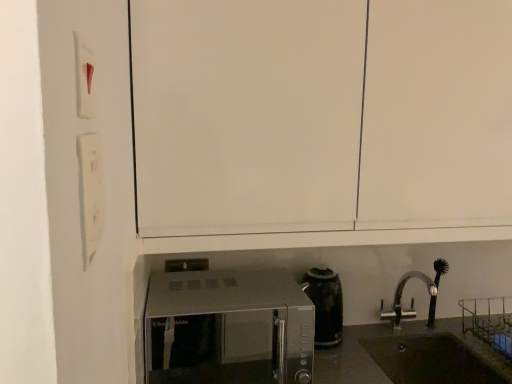
Question: Is satin silver microwave at lower center positioned in front of black matte sink at lower right?

Choices:
 (A) yes
 (B) no

Answer: (A)

Question: Is satin silver microwave at lower center not near black matte sink at lower right?

Choices:
 (A) no
 (B) yes

Answer: (B)

Question: Is satin silver microwave at lower center to the right of black matte sink at lower right from the viewer's perspective?

Choices:
 (A) no
 (B) yes

Answer: (A)

Question: Considering the relative sizes of satin silver microwave at lower center and black matte sink at lower right in the image provided, is satin silver microwave at lower center bigger than black matte sink at lower right?

Choices:
 (A) yes
 (B) no

Answer: (A)

Question: Is satin silver microwave at lower center oriented towards black matte sink at lower right?

Choices:
 (A) no
 (B) yes

Answer: (A)

Question: From the image's perspective, is white plastic light switch at upper left, placed as the second light switch when sorted from bottom to top, above or below white matte cabinet at upper center?

Choices:
 (A) above
 (B) below

Answer: (B)

Question: Looking at their shapes, would you say white plastic light switch at upper left, placed as the second light switch when sorted from bottom to top, is wider or thinner than white matte cabinet at upper center?

Choices:
 (A) wide
 (B) thin

Answer: (B)

Question: From their relative heights in the image, would you say white plastic light switch at upper left, placed as the second light switch when sorted from bottom to top, is taller or shorter than white matte cabinet at upper center?

Choices:
 (A) short
 (B) tall

Answer: (A)

Question: Is point (77, 109) closer or farther from the camera than point (181, 223)?

Choices:
 (A) closer
 (B) farther

Answer: (A)

Question: Is white matte cabinet at upper center inside or outside of satin silver microwave at lower center?

Choices:
 (A) inside
 (B) outside

Answer: (B)

Question: From a real-world perspective, is white matte cabinet at upper center above or below satin silver microwave at lower center?

Choices:
 (A) below
 (B) above

Answer: (B)

Question: Considering the positions of white matte cabinet at upper center and satin silver microwave at lower center in the image, is white matte cabinet at upper center taller or shorter than satin silver microwave at lower center?

Choices:
 (A) short
 (B) tall

Answer: (B)

Question: Would you say white matte cabinet at upper center is to the left or to the right of satin silver microwave at lower center in the picture?

Choices:
 (A) right
 (B) left

Answer: (A)

Question: Is satin silver microwave at lower center wider or thinner than white matte cabinet at upper center?

Choices:
 (A) thin
 (B) wide

Answer: (B)

Question: Is satin silver microwave at lower center inside the boundaries of white matte cabinet at upper center, or outside?

Choices:
 (A) inside
 (B) outside

Answer: (B)